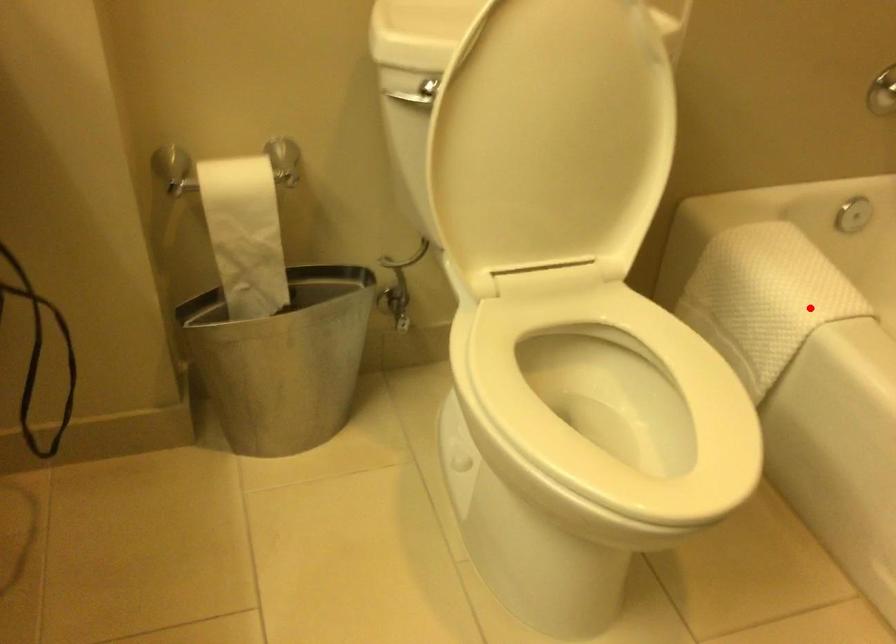
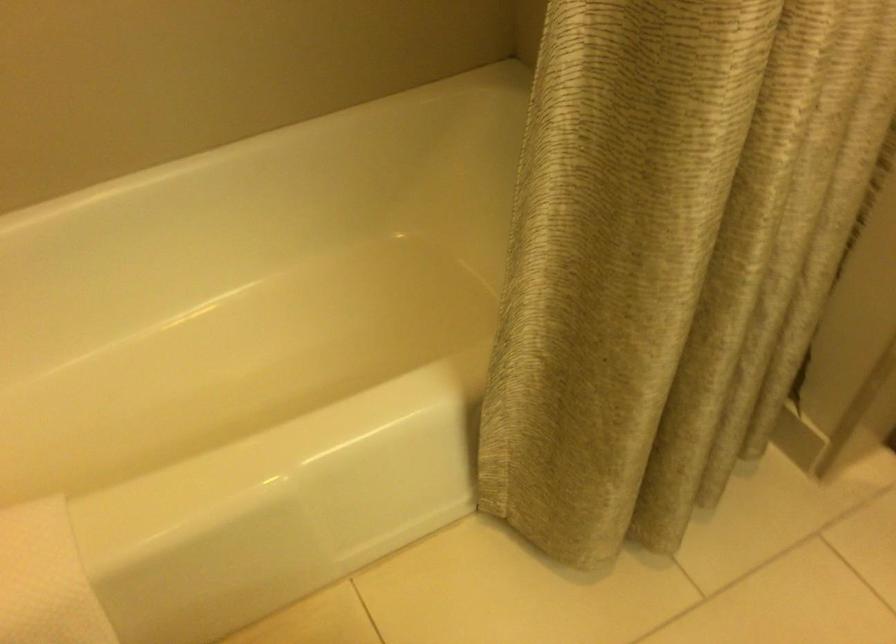
Question: I am providing you with two images of the same scene from different viewpoints. Given a red point in image1, look at the same physical point in image2. Is it:

Choices:
 (A) Closer to the viewpoint
 (B) Farther from the viewpoint

Answer: (A)